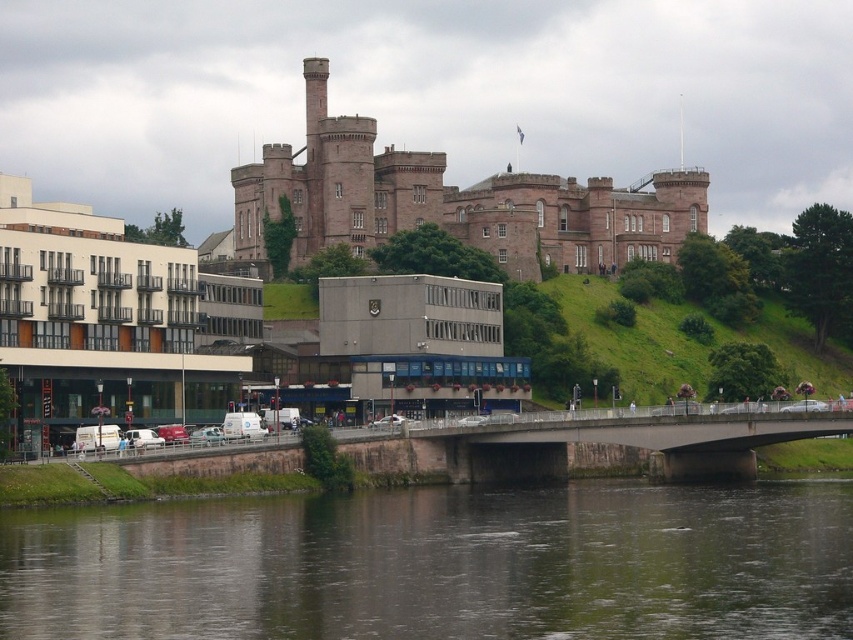
You are standing at the base of the historic castle on the grassy hill and want to cross the river to reach the bridge. Which direction should you walk to get to the dark gray water at lower center?

You should walk towards the lower center direction to reach the dark gray water at lower center, as it is located at point coordinates of (440, 564).

You are standing on the bridge and see the dark gray water at lower center and the brown stone castle at upper center. Which object is closer to your current position?

The dark gray water at lower center is closer to your current position because it is located below the brown stone castle at upper center, which is higher up.